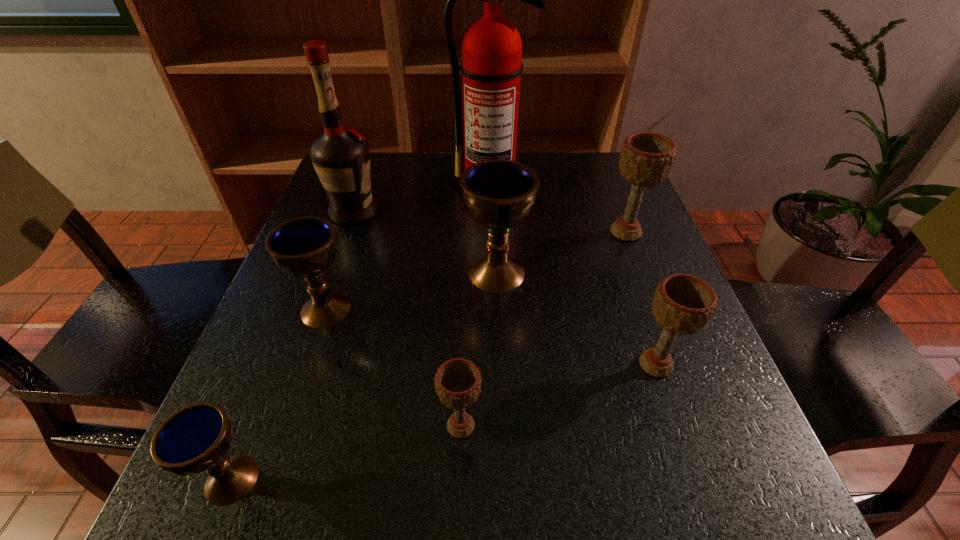
This screenshot has height=540, width=960. I want to click on fire extinguisher located at the far edge, so click(491, 66).

Identify the location of liquor situated at the far edge. The width and height of the screenshot is (960, 540). (341, 158).

Identify the location of object positioned at the near edge. Image resolution: width=960 pixels, height=540 pixels. (196, 438).

Where is `liquor located at the left edge`? The width and height of the screenshot is (960, 540). liquor located at the left edge is located at coordinates (341, 158).

This screenshot has height=540, width=960. What are the coordinates of `object that is positioned at the far left corner` in the screenshot? It's located at (341, 158).

Identify the location of object positioned at the near left corner. (196, 438).

Identify the location of free space at the far edge. (534, 158).

Identify the location of free space at the near edge of the desktop. The height and width of the screenshot is (540, 960). click(x=569, y=521).

The image size is (960, 540). In order to click on vacant space at the left edge of the desktop in this screenshot , I will do `click(376, 226)`.

I want to click on vacant space at the right edge of the desktop, so coord(612,288).